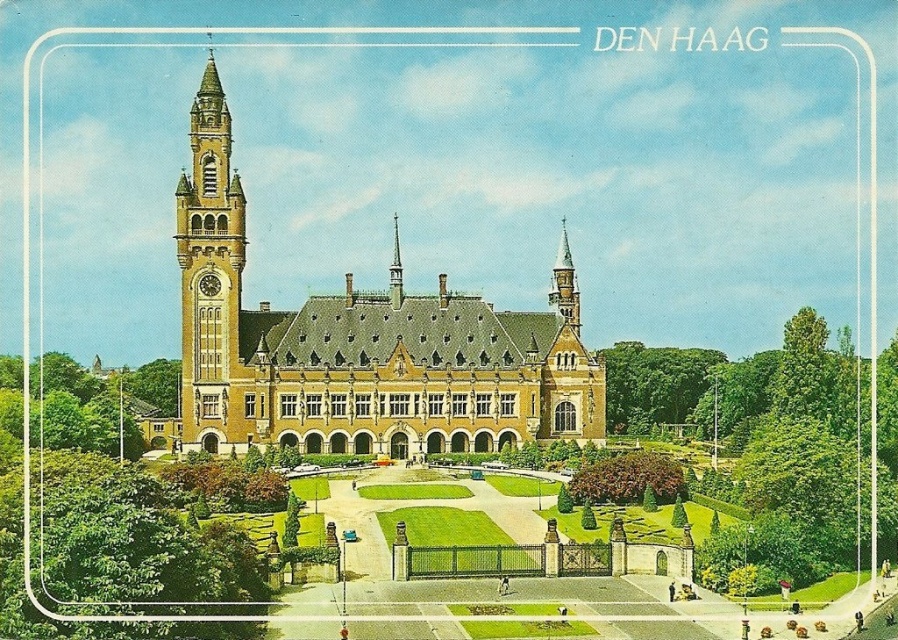
Question: Which point is farther from the camera taking this photo?

Choices:
 (A) (191, 212)
 (B) (557, 289)

Answer: (B)

Question: Does yellow brick church at left have a larger size compared to golden stone clock tower at left?

Choices:
 (A) no
 (B) yes

Answer: (B)

Question: Which is farther from the yellow brick church at left?

Choices:
 (A) shiny silver spire at center
 (B) polished copper spire at upper right

Answer: (B)

Question: From the image, what is the correct spatial relationship of golden stone clock tower at left in relation to shiny silver spire at center?

Choices:
 (A) below
 (B) above

Answer: (B)

Question: Can you confirm if yellow brick church at left is positioned below shiny silver spire at center?

Choices:
 (A) yes
 (B) no

Answer: (A)

Question: Which of the following is the closest to the observer?

Choices:
 (A) (468, 378)
 (B) (241, 404)
 (C) (393, 288)

Answer: (B)